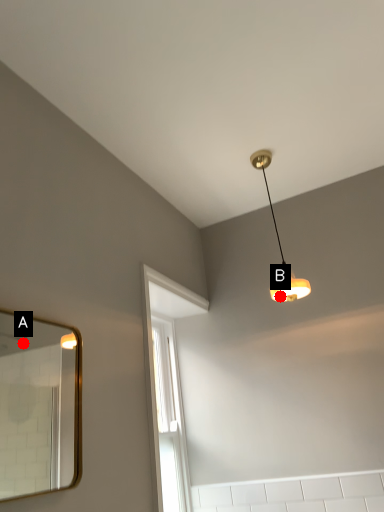
Question: Two points are circled on the image, labeled by A and B beside each circle. Which of the following is the farthest from the observer?

Choices:
 (A) A is further
 (B) B is further

Answer: (A)